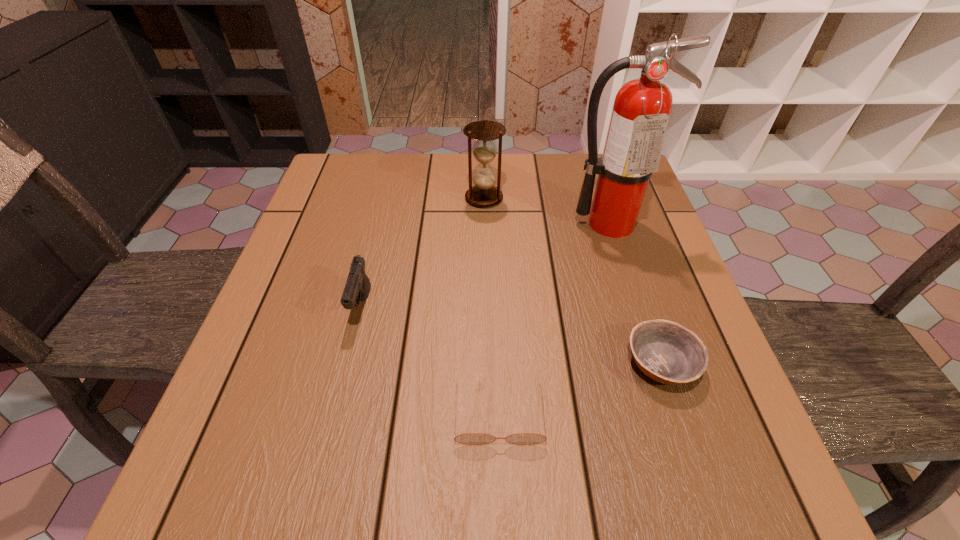
Where is `vacant space positioned 0.060m on the face of the sunglasses`? vacant space positioned 0.060m on the face of the sunglasses is located at coordinates (501, 484).

At what (x,y) coordinates should I click in order to perform the action: click on object at the far edge. Please return your answer as a coordinate pair (x, y). The width and height of the screenshot is (960, 540). Looking at the image, I should click on (484, 194).

This screenshot has height=540, width=960. What are the coordinates of `fire extinguisher that is positioned at the right edge` in the screenshot? It's located at (641, 110).

Find the location of a particular element. bowl present at the right edge is located at coordinates coord(669,353).

Locate an element on the screen. This screenshot has width=960, height=540. free region at the far edge of the desktop is located at coordinates (421, 186).

This screenshot has height=540, width=960. Identify the location of free region at the left edge of the desktop. (292, 326).

This screenshot has width=960, height=540. Identify the location of vacant space at the right edge of the desktop. (688, 313).

In order to click on free location at the far left corner of the desktop in this screenshot , I will do `click(375, 181)`.

Locate an element on the screen. vacant space that is in between the fire extinguisher and the third shortest object is located at coordinates (486, 265).

Locate an element on the screen. The width and height of the screenshot is (960, 540). vacant region between the second tallest object and the third tallest object is located at coordinates (423, 252).